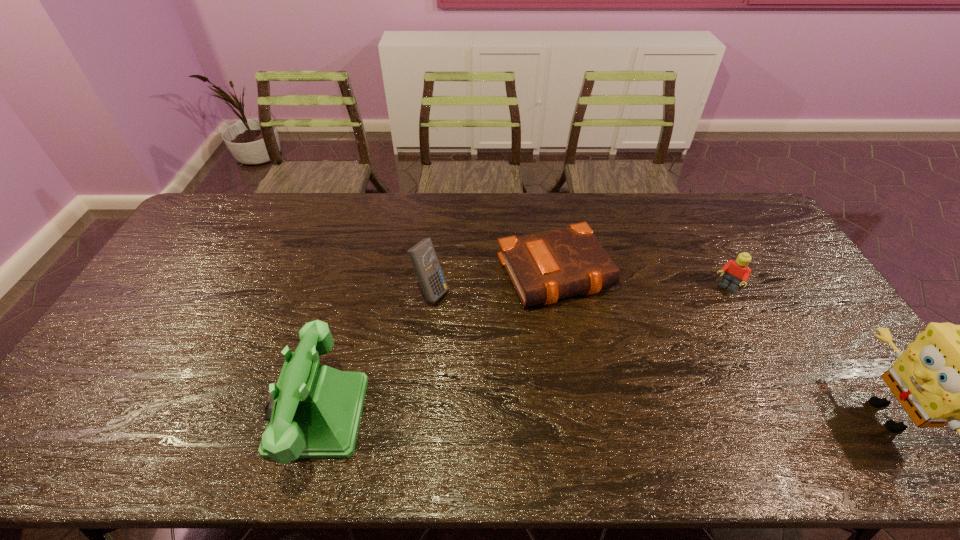
Locate an element on the screen. This screenshot has height=540, width=960. the second tallest object is located at coordinates (313, 411).

Where is `telephone`? This screenshot has width=960, height=540. telephone is located at coordinates (313, 411).

You are a GUI agent. You are given a task and a screenshot of the screen. Output one action in this format:
    pyautogui.click(x=<x>, y=<y>)
    Task: Click on the calculator
    This screenshot has width=960, height=540.
    Given the screenshot: What is the action you would take?
    pyautogui.click(x=422, y=255)

The width and height of the screenshot is (960, 540). I want to click on the third shortest object, so click(422, 255).

Identify the location of the fourth tallest object. The image size is (960, 540). (737, 271).

What are the coordinates of `the fourth object from left to right` in the screenshot? It's located at (737, 271).

Locate an element on the screen. This screenshot has width=960, height=540. the shortest object is located at coordinates [x=543, y=267].

You are a GUI agent. You are given a task and a screenshot of the screen. Output one action in this format:
    pyautogui.click(x=<x>, y=<y>)
    Task: Click on the Bible
    The image size is (960, 540).
    Given the screenshot: What is the action you would take?
    pyautogui.click(x=543, y=267)

At what (x,y) coordinates should I click in order to perform the action: click on free space located 0.240m on the dial of the fourth shortest object. Please return your answer as a coordinate pair (x, y). The height and width of the screenshot is (540, 960). Looking at the image, I should click on (175, 415).

Find the location of a particular element. This screenshot has width=960, height=540. vacant space located 0.180m on the dial of the fourth shortest object is located at coordinates click(199, 415).